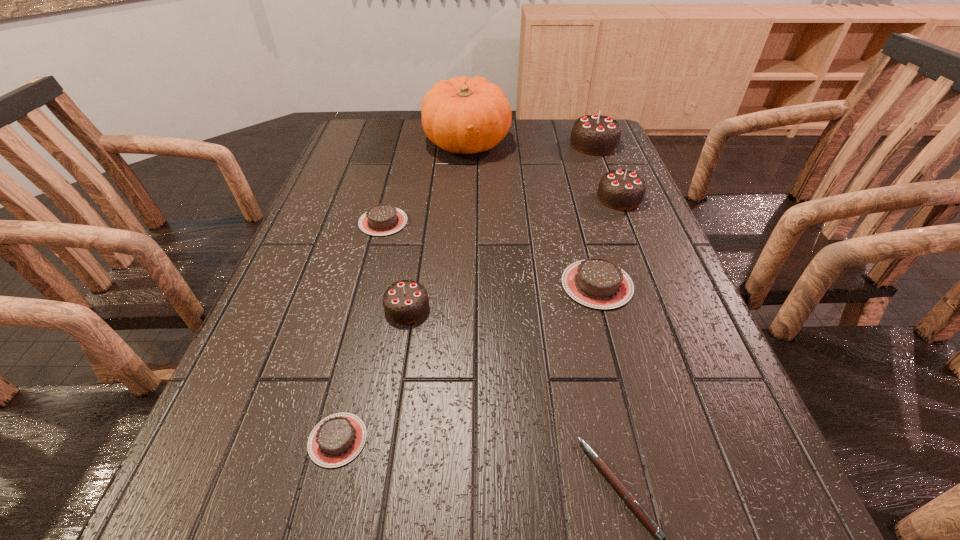
In order to click on free space located on the left of the smallest brown chocolate cake in this screenshot , I will do `click(207, 440)`.

Identify the location of pumpkin situated at the far edge. This screenshot has height=540, width=960. (461, 115).

You are a GUI agent. You are given a task and a screenshot of the screen. Output one action in this format:
    pyautogui.click(x=<x>, y=<y>)
    Task: Click on the chocolate cake at the far edge
    Image resolution: width=960 pixels, height=540 pixels.
    Given the screenshot: What is the action you would take?
    pyautogui.click(x=595, y=134)

Identify the location of object situated at the left edge. This screenshot has width=960, height=540. (382, 219).

You are a GUI agent. You are given a task and a screenshot of the screen. Output one action in this format:
    pyautogui.click(x=<x>, y=<y>)
    Task: Click on the object present at the far right corner
    The image size is (960, 540).
    Given the screenshot: What is the action you would take?
    pyautogui.click(x=595, y=134)

The image size is (960, 540). I want to click on vacant space at the near edge of the desktop, so click(449, 518).

Locate an element on the screen. The width and height of the screenshot is (960, 540). free space at the left edge of the desktop is located at coordinates (324, 199).

Where is `free space at the right edge`? free space at the right edge is located at coordinates 594,165.

The height and width of the screenshot is (540, 960). I want to click on vacant space at the far left corner, so click(372, 140).

Locate an element on the screen. vacant space in between the farthest brown chocolate cake and the nearest chocolate chocolate cake is located at coordinates (396, 265).